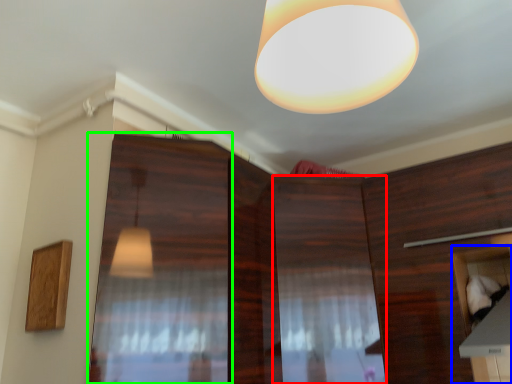
Question: Which object is the farthest from cabinetry (highlighted by a red box)? Choose among these: cabinetry (highlighted by a blue box) or screen door (highlighted by a green box).

Choices:
 (A) cabinetry
 (B) screen door

Answer: (B)